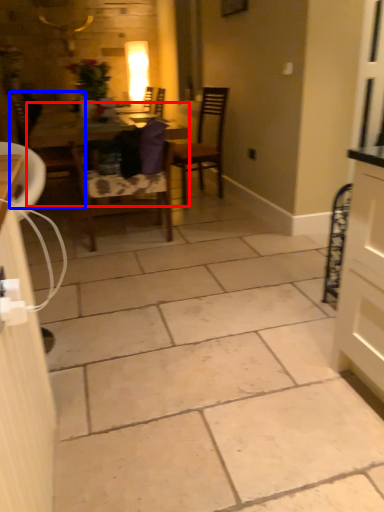
Question: Among these objects, which one is nearest to the camera, table (highlighted by a red box) or chair (highlighted by a blue box)?

Choices:
 (A) table
 (B) chair

Answer: (A)